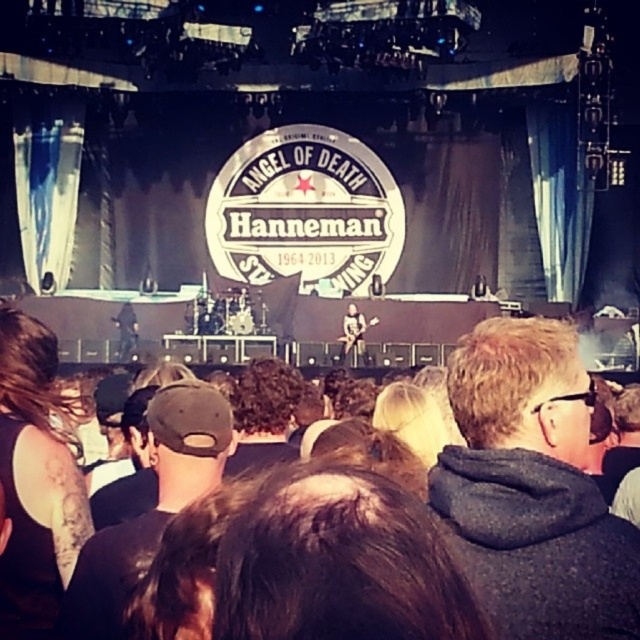
You are a photographer at the back of the concert hall. You want to take a photo of the dark gray hoodie at center and the dark brown hair at lower left. Can you see both subjects clearly in the same frame without any obstruction?

The dark gray hoodie at center is in front of dark brown hair at lower left, so the dark gray hoodie at center may block the view of dark brown hair at lower left in the photo.

You are a photographer at the concert and want to capture a closeup shot of the dark brown hair at lower left and the black fabric cap at center. Which object should you zoom in on first to ensure it fits entirely within the frame?

The dark brown hair at lower left has a smaller width than the black fabric cap at center, so you should zoom in on the black fabric cap at center first to ensure it fits entirely within the frame.

You are an audience member sitting at the front row. You notice two points on the stage, one at point (563,550) and another at point (61,625). Which point appears closer to you?

Point (563,550) is closer to the camera than point (61,625), so the point at (563,550) appears closer to you.